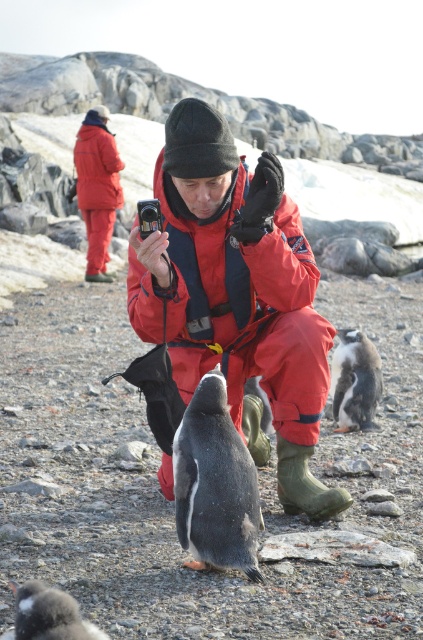
Based on the photo, who is shorter, gray matte penguin at center or white fluffy penguin at lower left?

white fluffy penguin at lower left is shorter.

Is gray matte penguin at center thinner than white fluffy penguin at lower left?

Yes, gray matte penguin at center is thinner than white fluffy penguin at lower left.

Is point (222, 385) closer to viewer compared to point (41, 620)?

No, (222, 385) is behind (41, 620).

The height and width of the screenshot is (640, 423). Find the location of `gray matte penguin at center`. gray matte penguin at center is located at coordinates (214, 484).

What do you see at coordinates (214, 484) in the screenshot? This screenshot has height=640, width=423. I see `gray matte penguin at center` at bounding box center [214, 484].

Which is in front, point (187, 547) or point (368, 406)?

Positioned in front is point (187, 547).

Locate an element on the screen. The height and width of the screenshot is (640, 423). gray matte penguin at center is located at coordinates (214, 484).

Does gray matte penguin at center have a greater height compared to matte red jacket at upper left?

No, gray matte penguin at center is not taller than matte red jacket at upper left.

Between gray matte penguin at center and matte red jacket at upper left, which one appears on the right side from the viewer's perspective?

gray matte penguin at center

Which is behind, point (200, 400) or point (109, 144)?

Positioned behind is point (109, 144).

Locate an element on the screen. Image resolution: width=423 pixels, height=640 pixels. gray matte penguin at center is located at coordinates (214, 484).